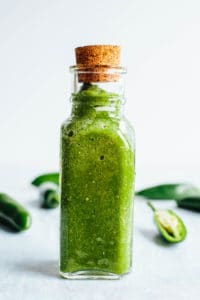
Find the location of a particular element. The height and width of the screenshot is (300, 200). bottle is located at coordinates (105, 210).